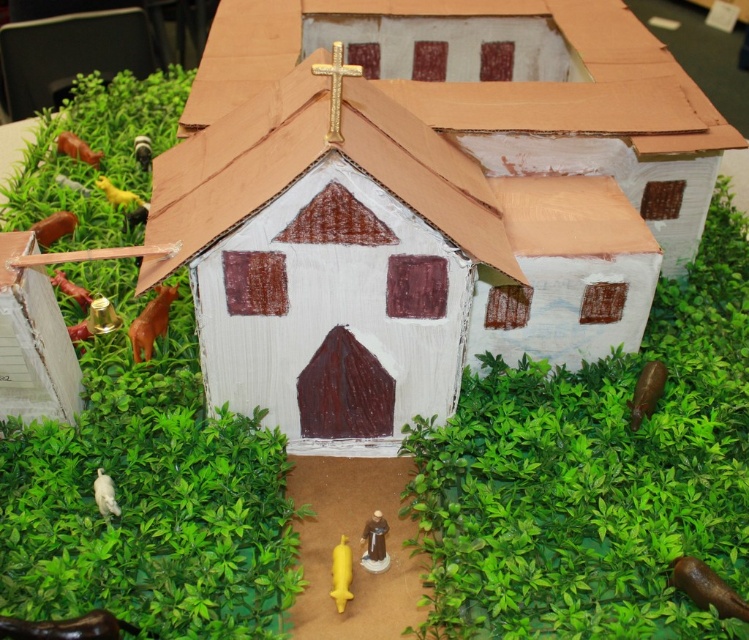
Who is more distant from viewer, (369,540) or (112,513)?

Point (112,513)

Can you confirm if matte brown statue at lower center is thinner than white matte bird at lower left?

Correct, matte brown statue at lower center's width is less than white matte bird at lower left's.

The image size is (749, 640). I want to click on matte brown statue at lower center, so click(374, 544).

This screenshot has width=749, height=640. I want to click on matte brown statue at lower center, so click(374, 544).

Consider the image. Is white cardboard hut at center closer to the viewer compared to matte brown statue at lower center?

That is True.

Is point (222, 224) farther from camera compared to point (372, 520)?

No, it is in front of (372, 520).

Which is in front, point (491, 84) or point (386, 566)?

Point (386, 566)

Where is `white cardboard hut at center`? This screenshot has height=640, width=749. white cardboard hut at center is located at coordinates (466, 148).

Measure the distance between white cardboard hut at center and white matte bird at lower left.

white cardboard hut at center is 32.56 inches away from white matte bird at lower left.

Can you confirm if white cardboard hut at center is bigger than white matte bird at lower left?

Correct, white cardboard hut at center is larger in size than white matte bird at lower left.

At what (x,y) coordinates should I click in order to perform the action: click on white cardboard hut at center. Please return your answer as a coordinate pair (x, y). The image size is (749, 640). Looking at the image, I should click on (466, 148).